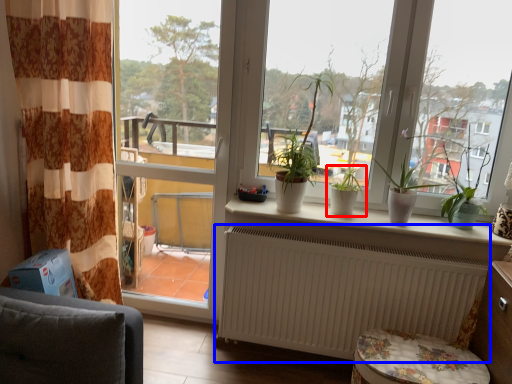
Question: Which point is further to the camera, houseplant (highlighted by a red box) or radiator (highlighted by a blue box)?

Choices:
 (A) houseplant
 (B) radiator

Answer: (A)